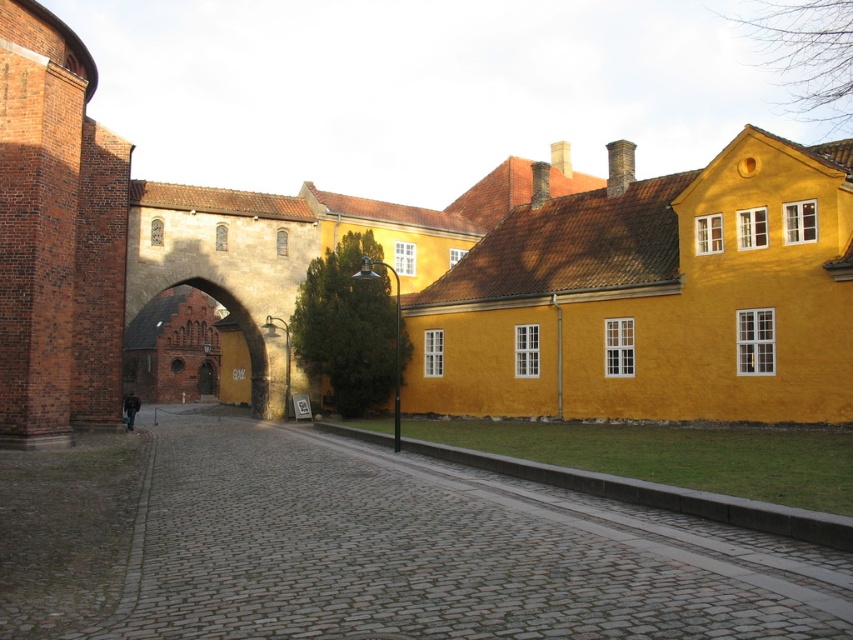
You are standing on the cobblestone street looking towards the historic building complex. There are two points marked on the ground in front of you at coordinates point [105,472] and point [173,310]. Which point is closer to you?

Point [105,472] is closer to the viewer than point [173,310].

You are standing at the entrance of the cobblestone alley at center and want to walk through the brown stone archway at center. Can you pass under the archway without bending down?

The cobblestone alley at center is located below the brown stone archway at center, so yes, you can pass under the archway without bending down as the alley is positioned beneath it.

You are a delivery person trying to navigate through the cobblestone alley at center and the brown stone archway at center. Which path allows a wider passage for your cart?

The brown stone archway at center allows a wider passage since it is wider than the cobblestone alley at center.